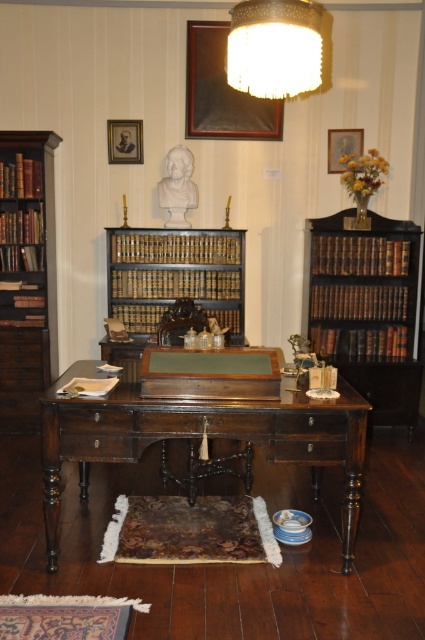
Question: Does white marble bust at center lie in front of wooden desk at center?

Choices:
 (A) yes
 (B) no

Answer: (A)

Question: In this image, where is dark wood drawer at center located relative to wooden drawer at center?

Choices:
 (A) below
 (B) above

Answer: (B)

Question: Which object is the farthest from the brown leather book at center?

Choices:
 (A) dark brown leather book at center right
 (B) brown leather book at right

Answer: (B)

Question: Is dark brown leather book at center right positioned behind white marble bust at center?

Choices:
 (A) yes
 (B) no

Answer: (A)

Question: Based on their relative distances, which object is nearer to the dark brown leather book at center right?

Choices:
 (A) hardcover book at center
 (B) brown wood bookshelf at left
 (C) wooden desk at center

Answer: (C)

Question: Among these points, which one is farthest from the camera?

Choices:
 (A) (175, 182)
 (B) (147, 288)

Answer: (B)